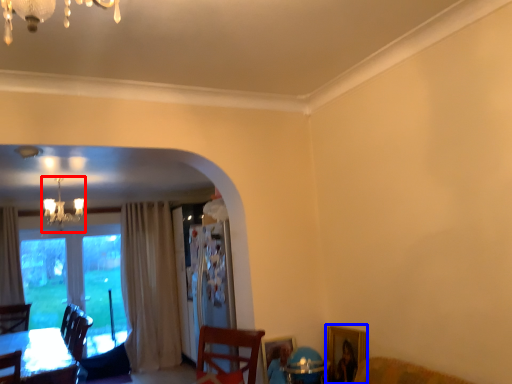
Question: Which point is further to the camera, lamp (highlighted by a red box) or picture frame (highlighted by a blue box)?

Choices:
 (A) lamp
 (B) picture frame

Answer: (A)